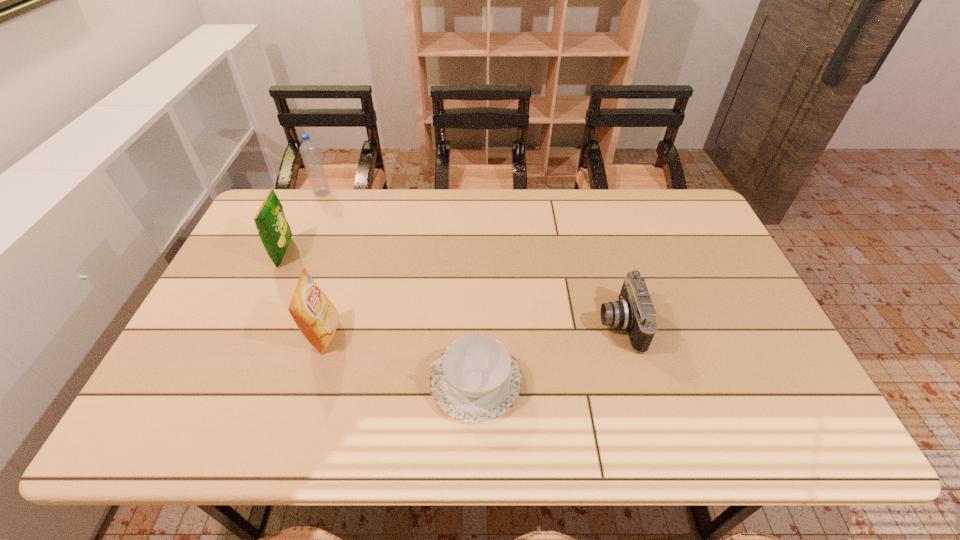
Image resolution: width=960 pixels, height=540 pixels. Find the location of `the farthest object`. the farthest object is located at coordinates (309, 150).

Locate an element on the screen. the second farthest object is located at coordinates (275, 233).

Where is `the left crisp (potato chip)`? the left crisp (potato chip) is located at coordinates (275, 233).

Identify the location of the nearer crisp (potato chip). (316, 317).

You are a GUI agent. You are given a task and a screenshot of the screen. Output one action in this format:
    pyautogui.click(x=<x>, y=<y>)
    Task: Click on the right crisp (potato chip)
    The image size is (960, 540).
    Given the screenshot: What is the action you would take?
    pyautogui.click(x=316, y=317)

Locate an element on the screen. The width and height of the screenshot is (960, 540). the second shortest object is located at coordinates [x=634, y=312].

You are a GUI agent. You are given a task and a screenshot of the screen. Output one action in this format:
    pyautogui.click(x=<x>, y=<y>)
    Task: Click on the rightmost object
    The width and height of the screenshot is (960, 540).
    Given the screenshot: What is the action you would take?
    pyautogui.click(x=634, y=312)

Locate an element on the screen. This screenshot has height=540, width=960. the shortest object is located at coordinates (476, 379).

Identify the location of chinaware. (476, 379).

Identify the location of free space located on the right of the water bottle. (355, 193).